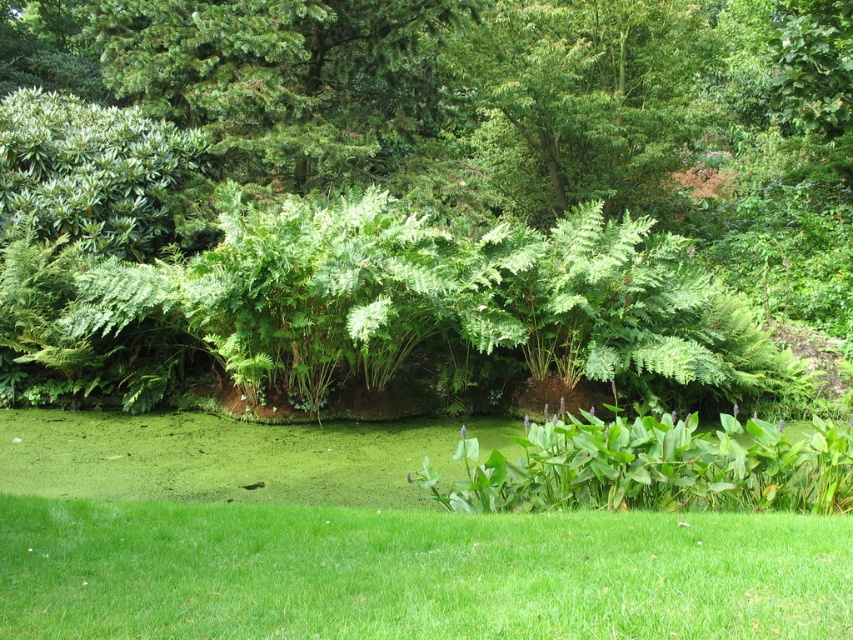
Question: From the image, what is the correct spatial relationship of green grass at lower center in relation to green leafy tree at upper center?

Choices:
 (A) left
 (B) right

Answer: (A)

Question: Which of the following is the farthest from the observer?

Choices:
 (A) (526, 209)
 (B) (134, 608)

Answer: (A)

Question: Which object is closer to the camera taking this photo?

Choices:
 (A) green leafy tree at upper center
 (B) green grass at lower center

Answer: (B)

Question: Can you confirm if green grass at lower center is thinner than green leafy tree at upper center?

Choices:
 (A) yes
 (B) no

Answer: (B)

Question: Is green grass at lower center further to camera compared to green leafy tree at upper center?

Choices:
 (A) no
 (B) yes

Answer: (A)